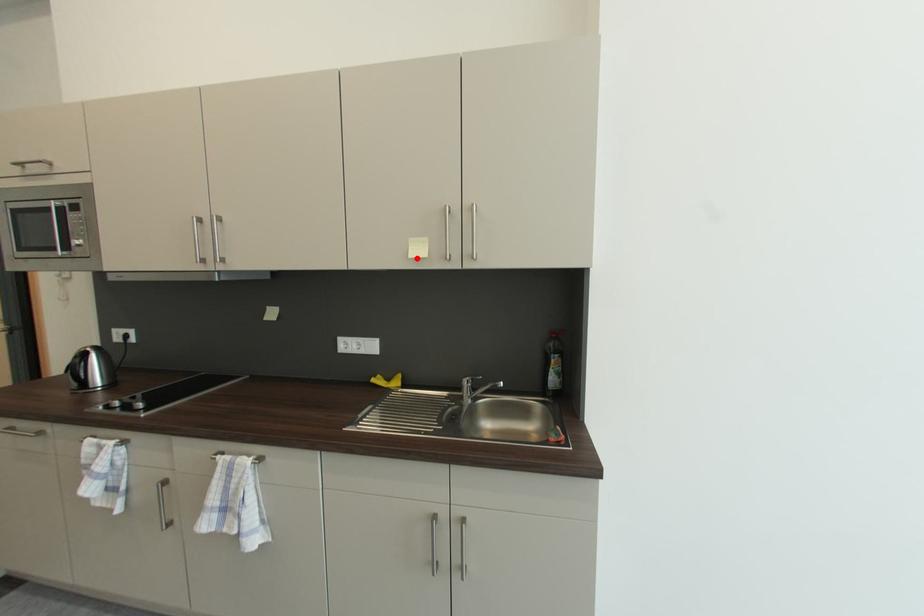
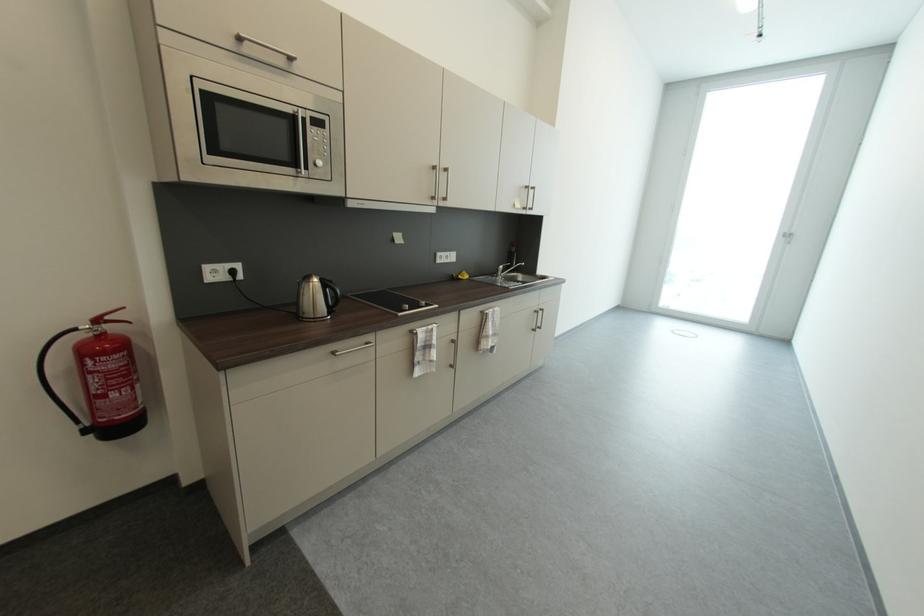
Find the pixel in the second image that matches the highlighted location in the first image.

(523, 209)